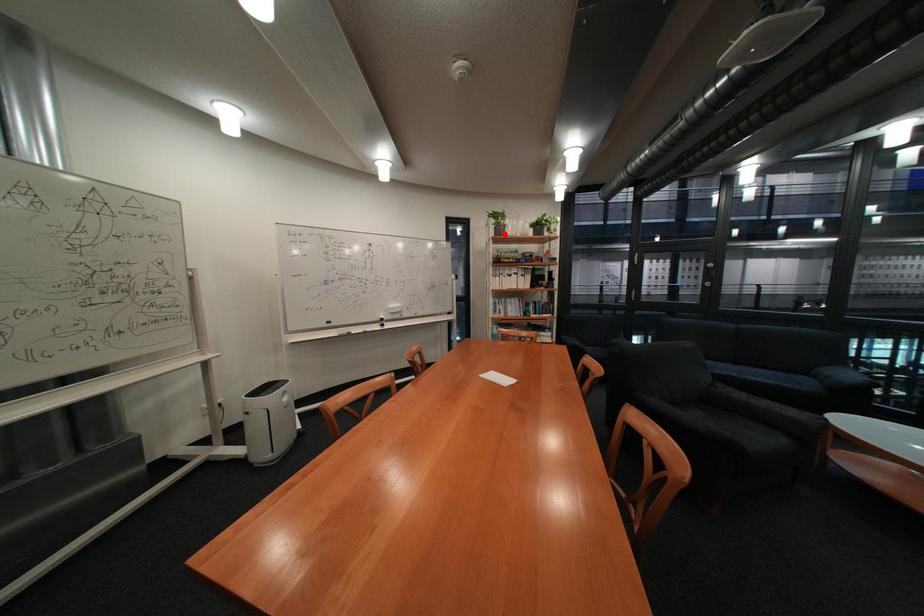
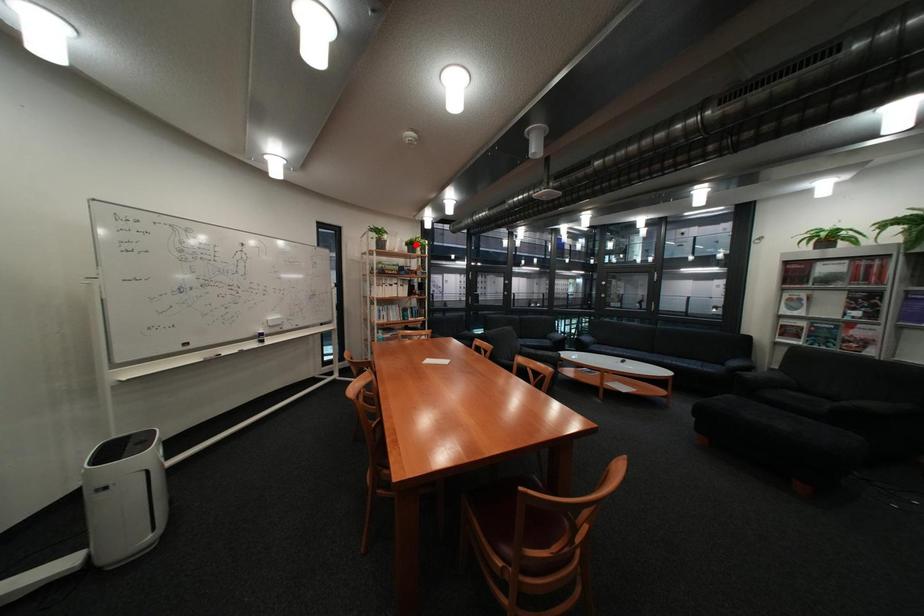
I am providing you with two images of the same scene from different viewpoints. A red point is marked on the first image and another point is marked on the second image. Is the red point in image1 aligned with the point shown in image2?

Result: No